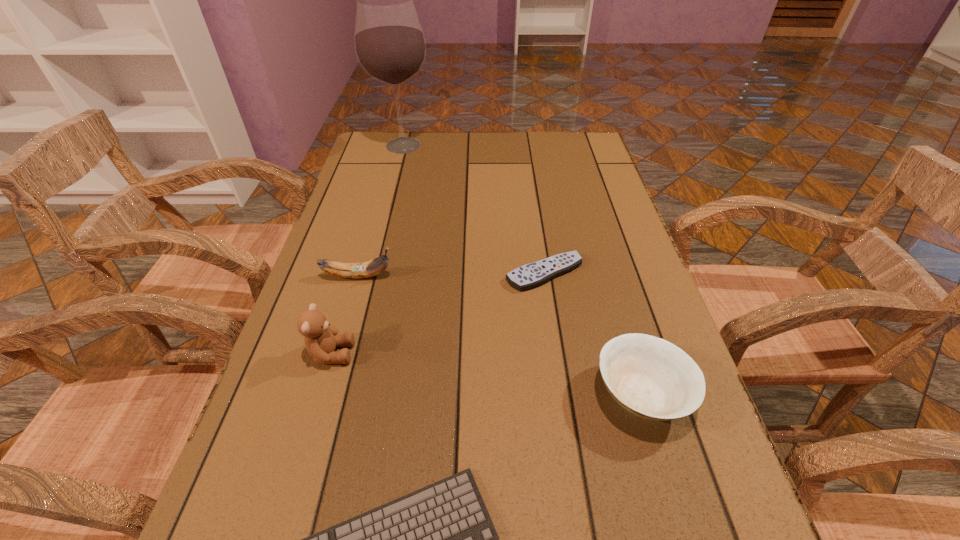
Image resolution: width=960 pixels, height=540 pixels. In the image, there is a desktop. In order to click on blank space at the right edge in this screenshot , I will do `click(588, 233)`.

Image resolution: width=960 pixels, height=540 pixels. What are the coordinates of `free spot at the far right corner of the desktop` in the screenshot? It's located at (548, 158).

Identify the location of free area in between the remote control and the bowl. This screenshot has height=540, width=960. (593, 333).

Image resolution: width=960 pixels, height=540 pixels. Find the location of `empty space between the teddy bear and the banana`. empty space between the teddy bear and the banana is located at coordinates (345, 315).

Find the location of `vacant space that is in between the third tallest object and the bowl`. vacant space that is in between the third tallest object and the bowl is located at coordinates (500, 335).

Find the location of `free space between the fourth tallest object and the third tallest object`. free space between the fourth tallest object and the third tallest object is located at coordinates (500, 335).

Find the location of a particular element. This screenshot has width=960, height=540. free point between the remote control and the tallest object is located at coordinates (473, 210).

Find the location of a particular element. the second closest object to the banana is located at coordinates (528, 276).

You are a GUI agent. You are given a task and a screenshot of the screen. Output one action in this format:
    pyautogui.click(x=<x>, y=<y>)
    Task: Click on the object that can be found as the second closest to the teddy bear
    
    Given the screenshot: What is the action you would take?
    pyautogui.click(x=440, y=539)

Locate an element on the screen. Image resolution: width=960 pixels, height=540 pixels. vacant area that satisfies the following two spatial constraints: 1. on the face of the fifth shortest object; 2. on the right side of the third shortest object is located at coordinates (319, 394).